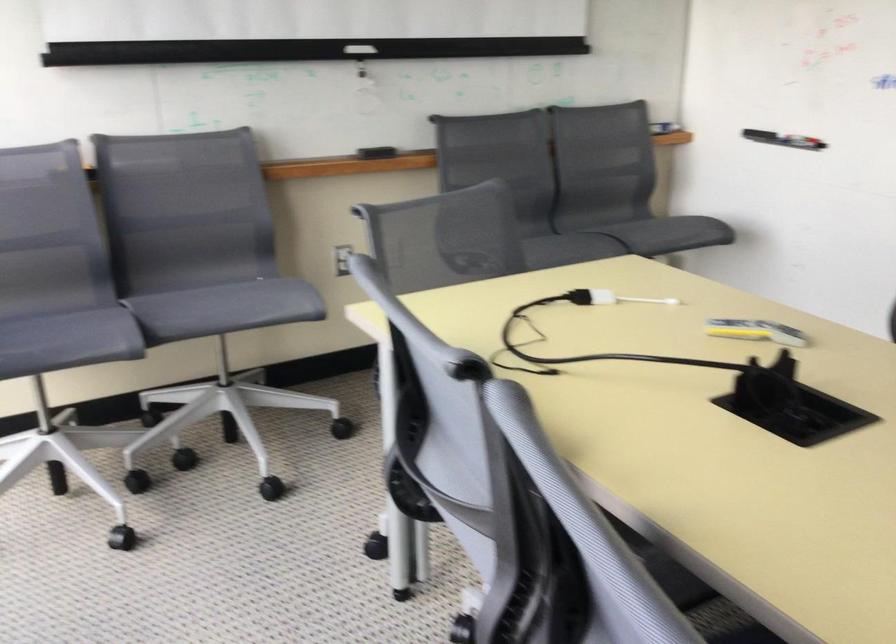
Find where to wip the whiteboard eraser. Please return your answer as a coordinate pair (x, y).

(359, 49)